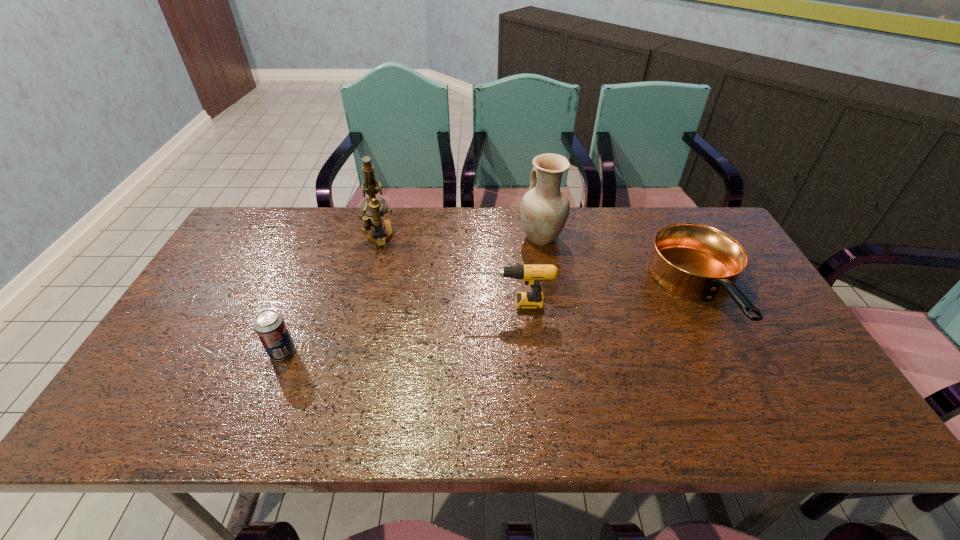
At what (x,y) coordinates should I click in order to perform the action: click on the second object from left to right. Please return your answer as a coordinate pair (x, y). Looking at the image, I should click on (373, 208).

I want to click on pottery, so click(x=544, y=210).

At what (x,y) coordinates should I click in order to perform the action: click on the rightmost object. Please return your answer as a coordinate pair (x, y). Looking at the image, I should click on (694, 261).

In order to click on drill in this screenshot , I will do `click(532, 274)`.

Identify the location of beer can. (269, 325).

This screenshot has height=540, width=960. I want to click on vacant region located on the back of the fourth object from right to left, so click(x=386, y=210).

Locate an element on the screen. The image size is (960, 540). vacant space positioned 0.280m on the right of the pottery is located at coordinates (652, 237).

Locate an element on the screen. free location located 0.050m on the handle side of the frying pan is located at coordinates (743, 376).

Image resolution: width=960 pixels, height=540 pixels. What are the coordinates of `free spot located 0.130m on the handle side of the drill` in the screenshot? It's located at (420, 303).

The image size is (960, 540). In order to click on vacant space located 0.140m on the handle side of the drill in this screenshot , I will do `click(417, 303)`.